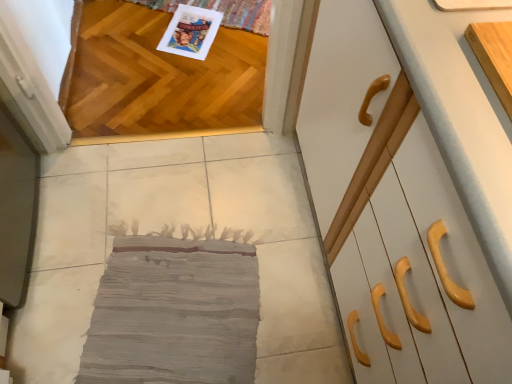
Question: Is light wood cutting board at upper right, arranged as the 2th cabinetry when viewed from the front, aimed at shiny oak hardwood at upper left?

Choices:
 (A) yes
 (B) no

Answer: (B)

Question: Is light wood cutting board at upper right, the first cabinetry positioned from the back, positioned with its back to shiny oak hardwood at upper left?

Choices:
 (A) no
 (B) yes

Answer: (A)

Question: Does light wood cutting board at upper right, the first cabinetry positioned from the back, lie in front of shiny oak hardwood at upper left?

Choices:
 (A) yes
 (B) no

Answer: (A)

Question: Is light wood cutting board at upper right, the first cabinetry positioned from the back, located outside shiny oak hardwood at upper left?

Choices:
 (A) no
 (B) yes

Answer: (B)

Question: Is shiny oak hardwood at upper left completely or partially inside light wood cutting board at upper right, arranged as the 2th cabinetry when viewed from the front?

Choices:
 (A) yes
 (B) no

Answer: (B)

Question: Looking at the image, does white glossy cabinet at right, the 2th cabinetry viewed from the back, seem bigger or smaller compared to shiny oak hardwood at upper left?

Choices:
 (A) big
 (B) small

Answer: (A)

Question: Which is correct: white glossy cabinet at right, the first cabinetry when ordered from front to back, is inside shiny oak hardwood at upper left, or outside of it?

Choices:
 (A) inside
 (B) outside

Answer: (B)

Question: Considering the positions of white glossy cabinet at right, the 2th cabinetry viewed from the back, and shiny oak hardwood at upper left in the image, is white glossy cabinet at right, the 2th cabinetry viewed from the back, wider or thinner than shiny oak hardwood at upper left?

Choices:
 (A) wide
 (B) thin

Answer: (B)

Question: Would you say white glossy cabinet at right, the 2th cabinetry viewed from the back, is to the left or to the right of shiny oak hardwood at upper left in the picture?

Choices:
 (A) left
 (B) right

Answer: (B)

Question: Considering the positions of shiny oak hardwood at upper left and gray fabric rug at center in the image, is shiny oak hardwood at upper left taller or shorter than gray fabric rug at center?

Choices:
 (A) tall
 (B) short

Answer: (A)

Question: Considering the relative positions of shiny oak hardwood at upper left and gray fabric rug at center in the image provided, is shiny oak hardwood at upper left to the left or to the right of gray fabric rug at center?

Choices:
 (A) left
 (B) right

Answer: (A)

Question: In terms of width, does shiny oak hardwood at upper left look wider or thinner when compared to gray fabric rug at center?

Choices:
 (A) wide
 (B) thin

Answer: (B)

Question: In the image, is shiny oak hardwood at upper left positioned in front of or behind gray fabric rug at center?

Choices:
 (A) behind
 (B) front

Answer: (A)

Question: Is light wood cutting board at upper right, the first cabinetry positioned from the back, inside or outside of shiny oak hardwood at upper left?

Choices:
 (A) inside
 (B) outside

Answer: (B)

Question: From a real-world perspective, is light wood cutting board at upper right, arranged as the 2th cabinetry when viewed from the front, above or below shiny oak hardwood at upper left?

Choices:
 (A) above
 (B) below

Answer: (A)